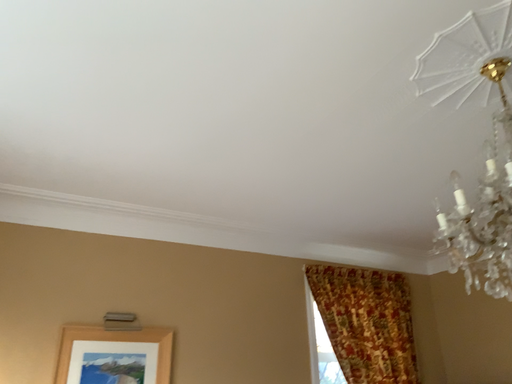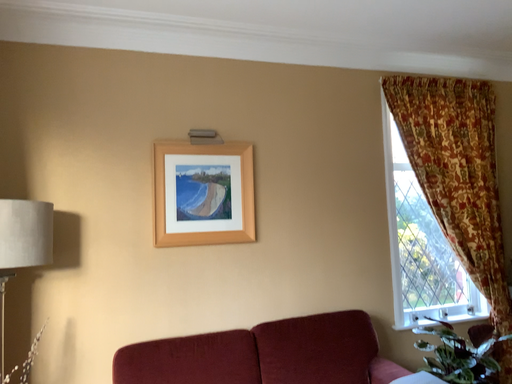
Question: How did the camera likely rotate when shooting the video?

Choices:
 (A) rotated right
 (B) rotated left

Answer: (B)